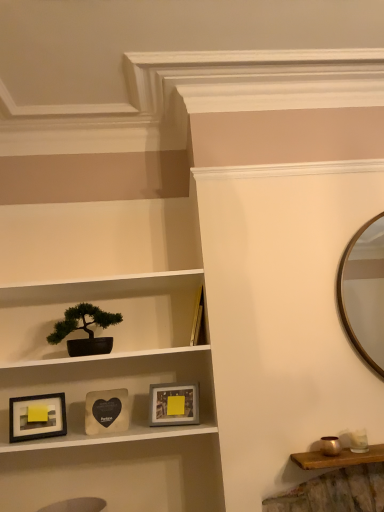
Question: From the image's perspective, is wooden heart-shaped picture frame at center, placed as the 2th picture frame when sorted from right to left, under matte black picture frame at lower left, arranged as the 3th picture frame when viewed from the right?

Choices:
 (A) yes
 (B) no

Answer: (B)

Question: Considering the relative positions of wooden heart-shaped picture frame at center, the second picture frame from the left, and matte black picture frame at lower left, arranged as the 3th picture frame when viewed from the right, in the image provided, is wooden heart-shaped picture frame at center, the second picture frame from the left, to the left of matte black picture frame at lower left, arranged as the 3th picture frame when viewed from the right, from the viewer's perspective?

Choices:
 (A) no
 (B) yes

Answer: (A)

Question: From a real-world perspective, is wooden heart-shaped picture frame at center, placed as the 2th picture frame when sorted from right to left, located higher than matte black picture frame at lower left, positioned as the 1th picture frame in left-to-right order?

Choices:
 (A) no
 (B) yes

Answer: (B)

Question: Does wooden heart-shaped picture frame at center, placed as the 2th picture frame when sorted from right to left, have a lesser width compared to matte black picture frame at lower left, positioned as the 1th picture frame in left-to-right order?

Choices:
 (A) yes
 (B) no

Answer: (B)

Question: Can you confirm if wooden heart-shaped picture frame at center, the second picture frame from the left, is shorter than matte black picture frame at lower left, arranged as the 3th picture frame when viewed from the right?

Choices:
 (A) yes
 (B) no

Answer: (B)

Question: Can you confirm if wooden heart-shaped picture frame at center, placed as the 2th picture frame when sorted from right to left, is positioned to the right of matte black picture frame at lower left, arranged as the 3th picture frame when viewed from the right?

Choices:
 (A) yes
 (B) no

Answer: (A)

Question: From the image's perspective, is matte black pot at center on top of matte black picture frame at lower left, arranged as the 3th picture frame when viewed from the right?

Choices:
 (A) yes
 (B) no

Answer: (A)

Question: Is matte black pot at center thinner than matte black picture frame at lower left, positioned as the 1th picture frame in left-to-right order?

Choices:
 (A) no
 (B) yes

Answer: (A)

Question: From a real-world perspective, is matte black pot at center on matte black picture frame at lower left, arranged as the 3th picture frame when viewed from the right?

Choices:
 (A) yes
 (B) no

Answer: (A)

Question: From the image's perspective, is matte black pot at center beneath matte black picture frame at lower left, positioned as the 1th picture frame in left-to-right order?

Choices:
 (A) yes
 (B) no

Answer: (B)

Question: Is matte black pot at center smaller than matte black picture frame at lower left, arranged as the 3th picture frame when viewed from the right?

Choices:
 (A) no
 (B) yes

Answer: (A)

Question: From a real-world perspective, is matte black pot at center positioned under matte black picture frame at lower left, positioned as the 1th picture frame in left-to-right order, based on gravity?

Choices:
 (A) yes
 (B) no

Answer: (B)

Question: Are green matte bonsai tree at left and matte black picture frame at lower left, arranged as the 3th picture frame when viewed from the right, far apart?

Choices:
 (A) yes
 (B) no

Answer: (B)